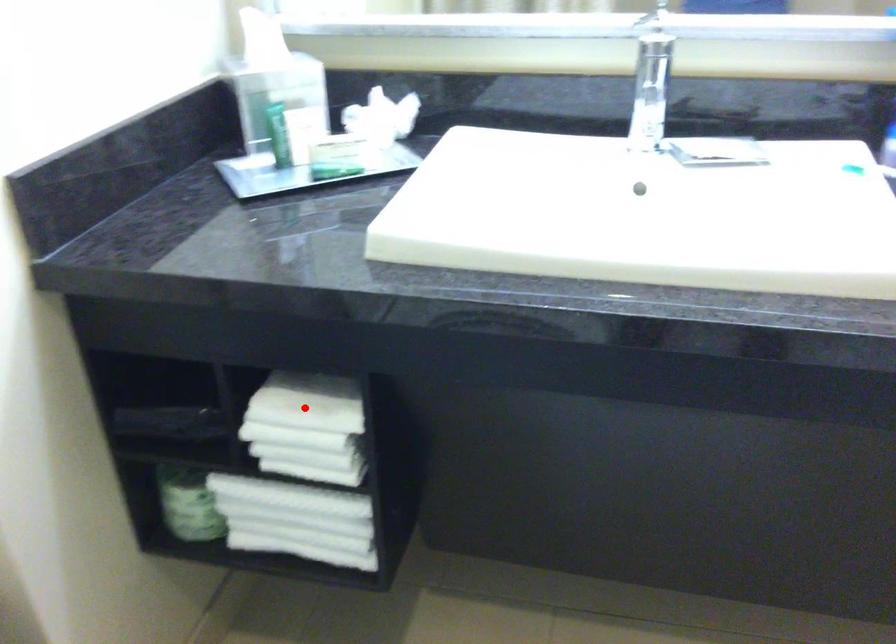
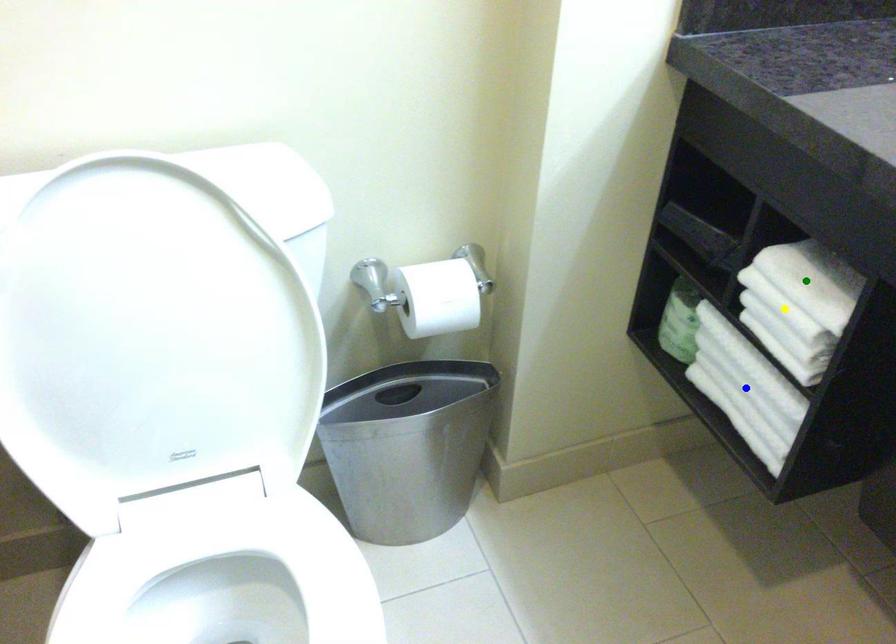
Question: I am providing you with two images of the same scene from different viewpoints. A red point is marked on the first image. You are given multiple points on the second image. Which point in image 2 represents the same 3d spot as the red point in image 1?

Choices:
 (A) blue point
 (B) yellow point
 (C) green point

Answer: (C)